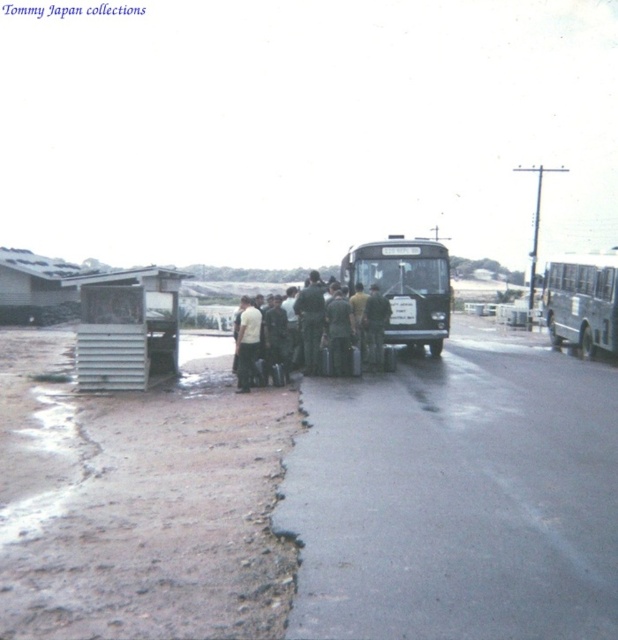
Which is in front, point (252, 344) or point (373, 324)?

Point (252, 344)

Does light yellow shirt at center appear over green fabric uniform at center?

Actually, light yellow shirt at center is below green fabric uniform at center.

Where is `light yellow shirt at center`? The width and height of the screenshot is (618, 640). light yellow shirt at center is located at coordinates (247, 342).

Which is behind, point (585, 273) or point (235, 365)?

Point (585, 273)

Between green matte bus at right and light yellow shirt at center, which one is positioned lower?

light yellow shirt at center

This screenshot has width=618, height=640. What do you see at coordinates (582, 301) in the screenshot?
I see `green matte bus at right` at bounding box center [582, 301].

Where is `green matte bus at right`? Image resolution: width=618 pixels, height=640 pixels. green matte bus at right is located at coordinates (582, 301).

Is black matte bus at center in front of green fabric uniform at center?

No, it is behind green fabric uniform at center.

In the scene shown: Is black matte bus at center to the right of green fabric uniform at center from the viewer's perspective?

Yes, black matte bus at center is to the right of green fabric uniform at center.

What do you see at coordinates (405, 285) in the screenshot? Image resolution: width=618 pixels, height=640 pixels. I see `black matte bus at center` at bounding box center [405, 285].

Locate an element on the screen. black matte bus at center is located at coordinates (405, 285).